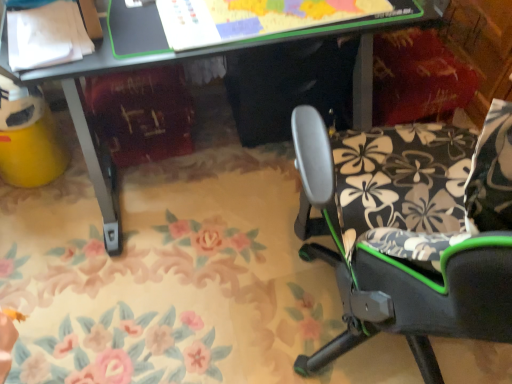
Question: From a real-world perspective, is matte black desk at center under black fabric chair at right?

Choices:
 (A) yes
 (B) no

Answer: (A)

Question: Is matte black desk at center outside of black fabric chair at right?

Choices:
 (A) no
 (B) yes

Answer: (B)

Question: Can you confirm if matte black desk at center is smaller than black fabric chair at right?

Choices:
 (A) no
 (B) yes

Answer: (A)

Question: From a real-world perspective, is matte black desk at center on top of black fabric chair at right?

Choices:
 (A) yes
 (B) no

Answer: (B)

Question: Does matte black desk at center touch black fabric chair at right?

Choices:
 (A) no
 (B) yes

Answer: (A)

Question: Does matte black desk at center turn towards black fabric chair at right?

Choices:
 (A) yes
 (B) no

Answer: (A)

Question: Does black fabric chair at right turn towards matte black desk at center?

Choices:
 (A) yes
 (B) no

Answer: (A)

Question: Can you confirm if black fabric chair at right is thinner than matte black desk at center?

Choices:
 (A) yes
 (B) no

Answer: (A)

Question: Does black fabric chair at right come behind matte black desk at center?

Choices:
 (A) no
 (B) yes

Answer: (A)

Question: Considering the relative sizes of black fabric chair at right and matte black desk at center in the image provided, is black fabric chair at right wider than matte black desk at center?

Choices:
 (A) yes
 (B) no

Answer: (B)

Question: Is black fabric chair at right positioned with its back to matte black desk at center?

Choices:
 (A) no
 (B) yes

Answer: (A)

Question: From the image's perspective, is black fabric chair at right on matte black desk at center?

Choices:
 (A) no
 (B) yes

Answer: (A)

Question: Considering the positions of matte black desk at center and black fabric chair at right in the image, is matte black desk at center taller or shorter than black fabric chair at right?

Choices:
 (A) tall
 (B) short

Answer: (A)